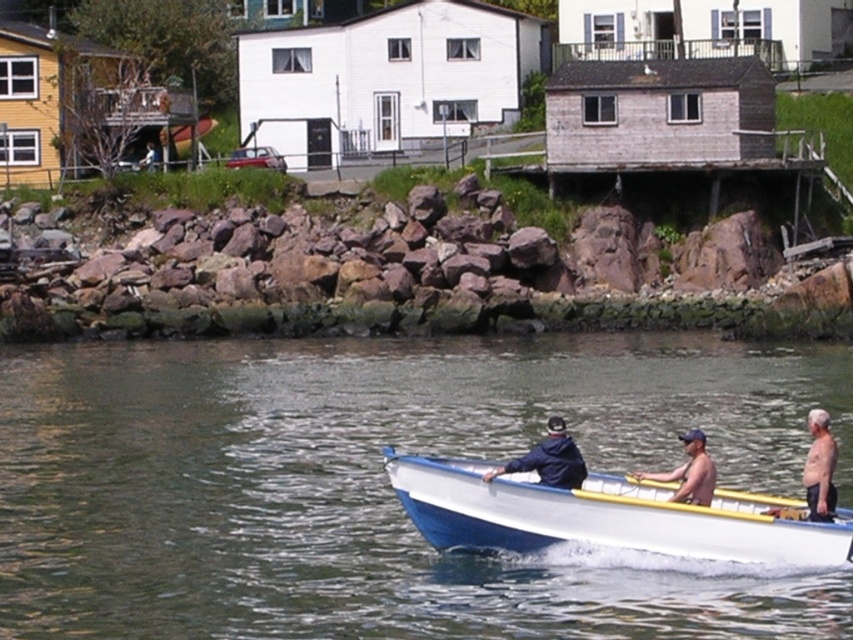
You are standing on the shore and see the white glossy boat at center. If you want to throw a small stone to reach the boat, would it be possible? Assume you can throw a stone up to 60 feet.

The white glossy boat at center is 59.22 feet away from the camera. Since you can throw a stone up to 60 feet, it is possible to reach the boat with your throw.

You are an observer standing on the rocky shoreline. You see two boats in the water, the white glossy boat at center and the light blue wood boat at center. Which boat takes up more space in the image?

The light blue wood boat at center takes up more space in the image because the white glossy boat at center occupies less space than it.